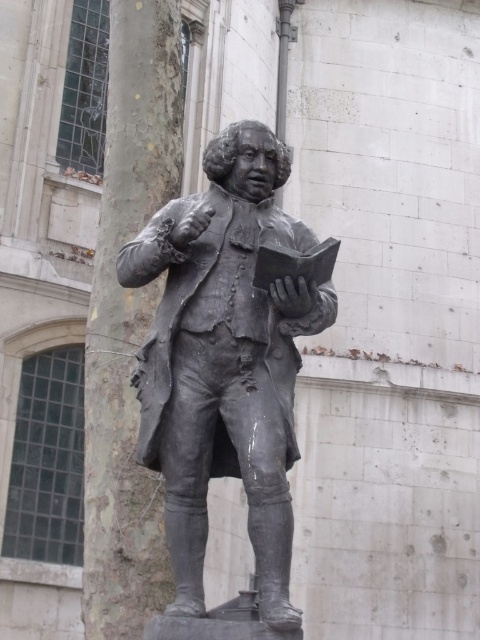
Question: Can you confirm if bronze statue at center is positioned above smooth bark tree trunk at left?

Choices:
 (A) no
 (B) yes

Answer: (B)

Question: Which point is closer to the camera?

Choices:
 (A) smooth bark tree trunk at left
 (B) bronze statue at center

Answer: (B)

Question: Is bronze statue at center above smooth bark tree trunk at left?

Choices:
 (A) yes
 (B) no

Answer: (A)

Question: Which object appears closest to the camera in this image?

Choices:
 (A) smooth bark tree trunk at left
 (B) bronze statue at center

Answer: (B)

Question: Does bronze statue at center have a larger size compared to smooth bark tree trunk at left?

Choices:
 (A) no
 (B) yes

Answer: (A)